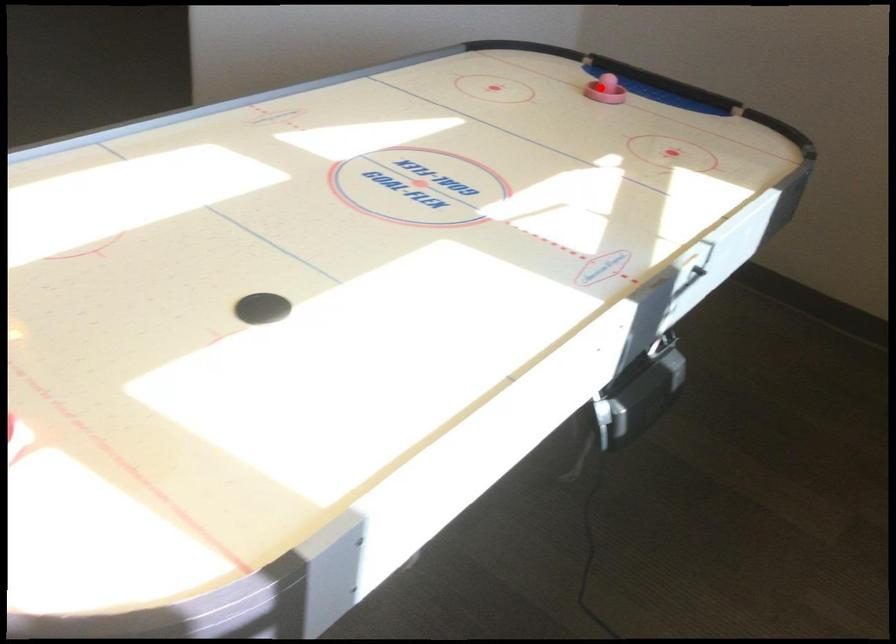
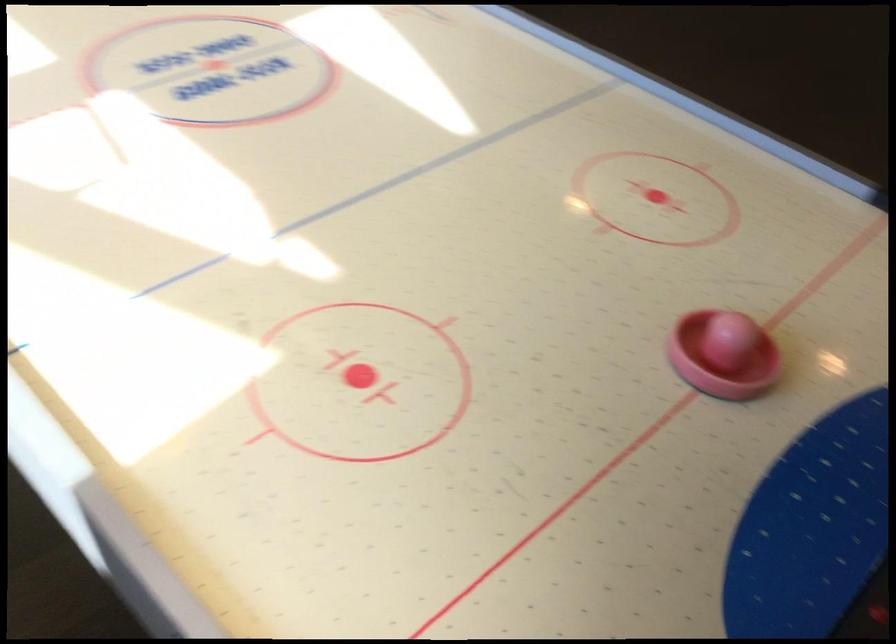
Question: I am providing you with two images of the same scene from different viewpoints. Image1 has a red point marked. In image2, the corresponding 3D location appears at what relative position? Reply with the corresponding letter.

Choices:
 (A) Closer
 (B) Farther

Answer: (A)